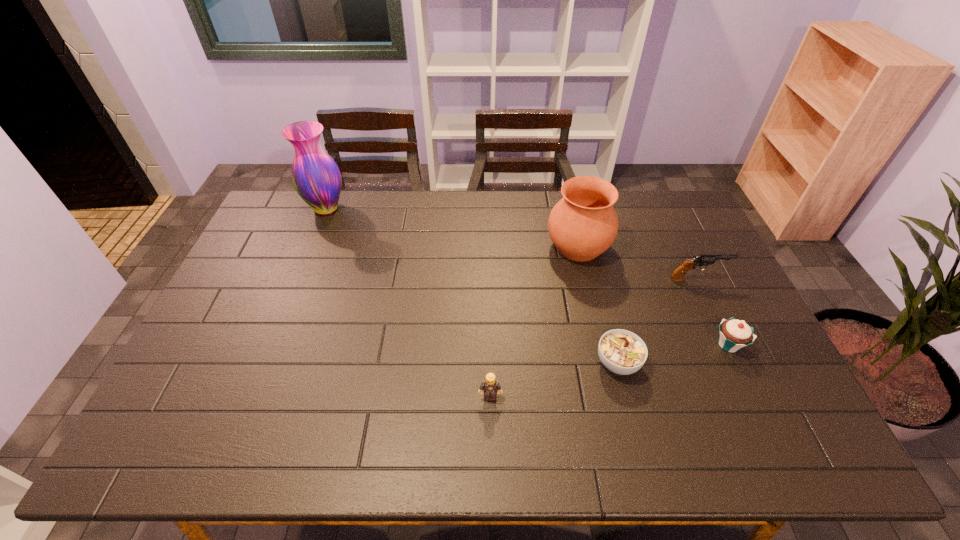
This screenshot has height=540, width=960. In order to click on free space that satisfies the following two spatial constraints: 1. along the barrel of the gun; 2. on the front side of the shortest object in this screenshot , I will do `click(737, 363)`.